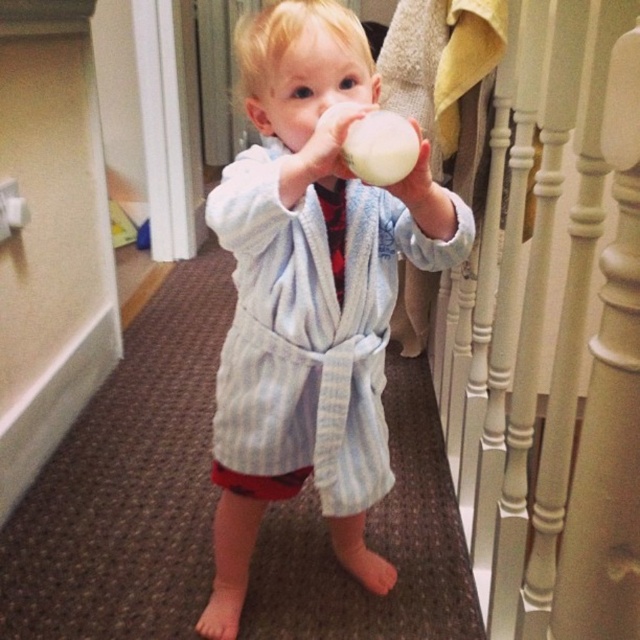
You are a painter who needs to paint the white painted wood at right and the light blue striped robe at center. Which object requires a taller ladder to reach its top?

The white painted wood at right requires a taller ladder because it has a greater height than the light blue striped robe at center.

You are a delivery person entering the hallway. You see the white painted wood at right and the light blue striped robe at center. Which object is closer to you?

The white painted wood at right is closer to you because it is in front of the light blue striped robe at center.